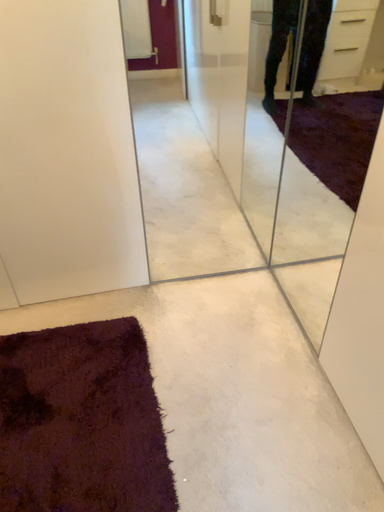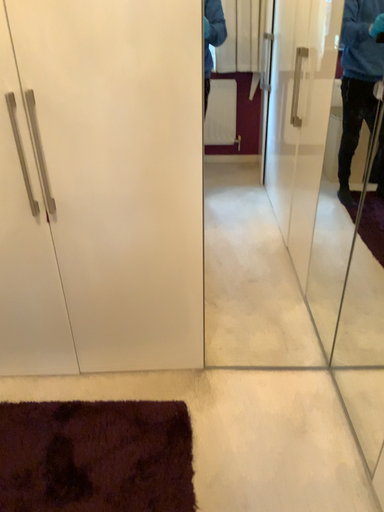
Question: Which way did the camera rotate in the video?

Choices:
 (A) rotated upward
 (B) rotated downward

Answer: (A)